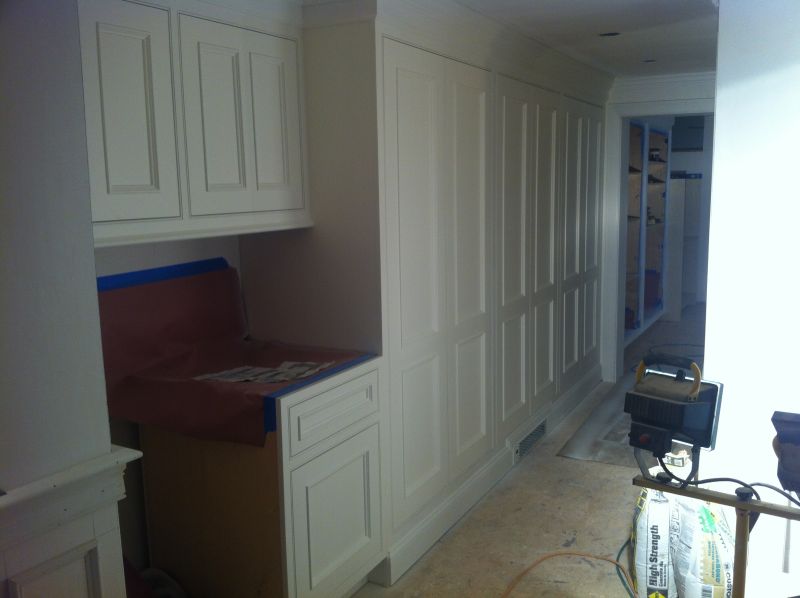
At what (x,y) coordinates should I click in order to perform the action: click on floor. Please return your answer as a coordinate pair (x, y). The image size is (800, 598). Looking at the image, I should click on (550, 521).